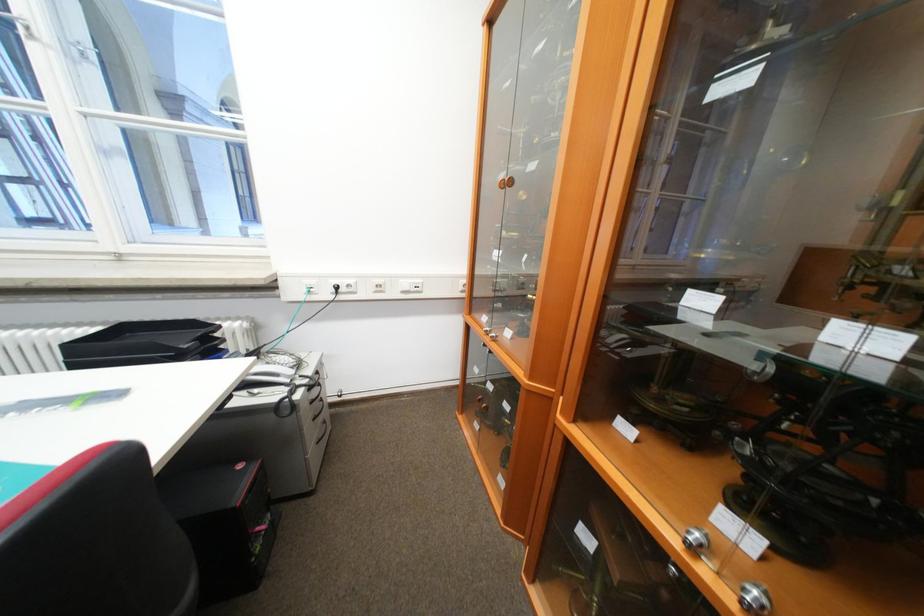
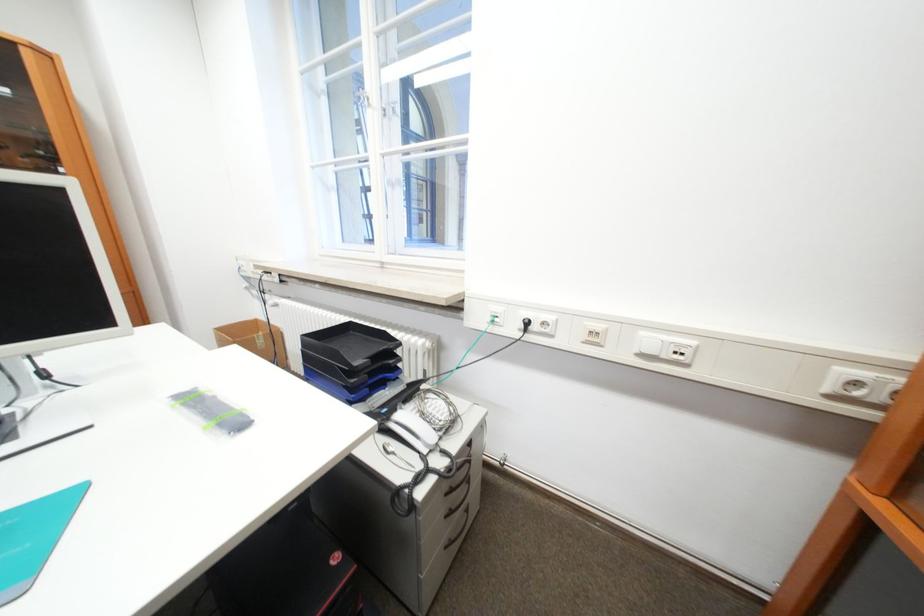
Question: The images are taken continuously from a first-person perspective. In which direction is your viewpoint rotating?

Choices:
 (A) Left
 (B) Right
 (C) Up
 (D) Down

Answer: (A)